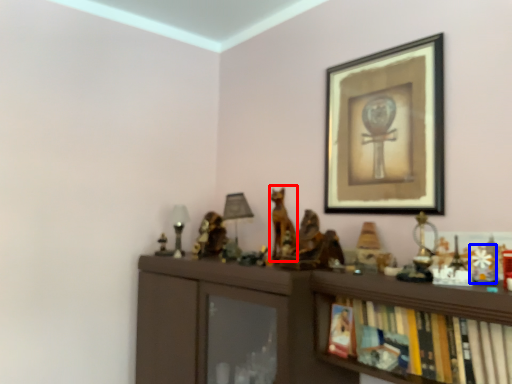
Question: Among these objects, which one is farthest to the camera, animal (highlighted by a red box) or toy (highlighted by a blue box)?

Choices:
 (A) animal
 (B) toy

Answer: (A)